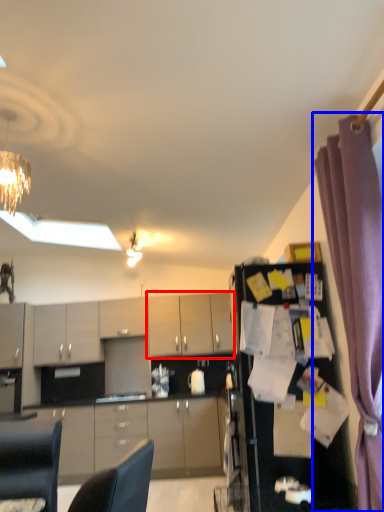
Question: Which of the following is the farthest to the observer, cabinetry (highlighted by a red box) or curtain (highlighted by a blue box)?

Choices:
 (A) cabinetry
 (B) curtain

Answer: (A)